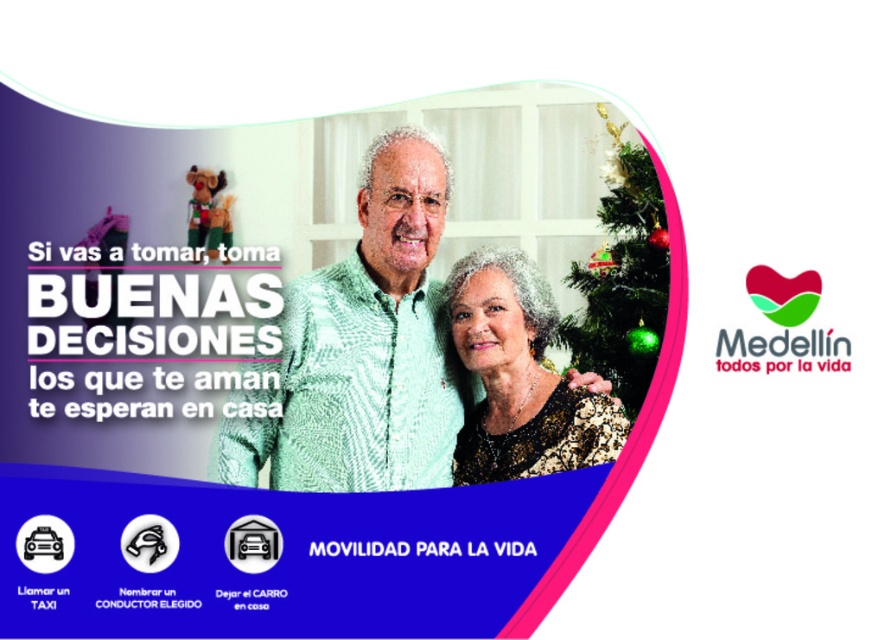
This screenshot has height=640, width=885. I want to click on green textured shirt at center, so click(x=360, y=349).

Is green textured shirt at center bigger than green shiny ornaments at upper right?

Correct, green textured shirt at center is larger in size than green shiny ornaments at upper right.

Who is more forward, (576, 385) or (622, 326)?

Point (576, 385) is more forward.

Image resolution: width=885 pixels, height=640 pixels. I want to click on green textured shirt at center, so click(360, 349).

Who is more distant from viewer, (x=499, y=292) or (x=608, y=336)?

The point (x=608, y=336) is more distant.

Can you confirm if sparkly gold dress at center is smaller than green shiny ornaments at upper right?

No.

Locate an element on the screen. This screenshot has height=640, width=885. sparkly gold dress at center is located at coordinates (519, 378).

Can you confirm if green textured shirt at center is positioned to the right of sparkly gold dress at center?

In fact, green textured shirt at center is to the left of sparkly gold dress at center.

In the scene shown: Is green textured shirt at center below sparkly gold dress at center?

Yes, green textured shirt at center is below sparkly gold dress at center.

Between point (317, 321) and point (550, 332), which one is positioned behind?

Point (550, 332)

You are a GUI agent. You are given a task and a screenshot of the screen. Output one action in this format:
    pyautogui.click(x=<x>, y=<y>)
    Task: Click on the green textured shirt at center
    This screenshot has width=885, height=640.
    Given the screenshot: What is the action you would take?
    pyautogui.click(x=360, y=349)